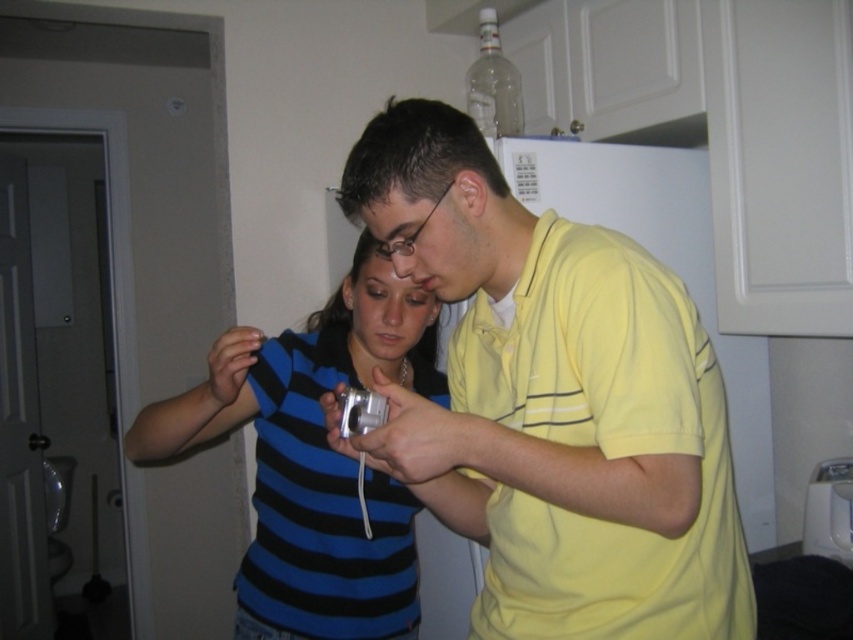
Looking at this image, you are a delivery person who needs to place a 12 inch long package between the blue striped shirt at center and the silver metallic game controller at center. Can you fit it there?

The blue striped shirt at center is 13.61 inches from the silver metallic game controller at center. Since the package is 12 inches long, it can fit between them as the distance is sufficient.

You are standing in the kitchen and see two points marked in the image. Which point, point [332,508] or point [383,400], is closer to you?

Point [332,508] is closer to you because it is further to the viewer than point [383,400].